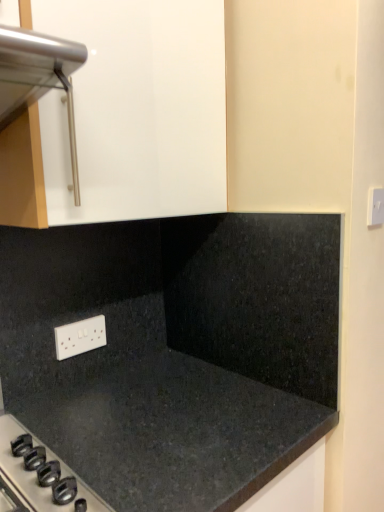
Question: Is white plastic electric outlet at lower left, the second electric outlet in the front-to-back sequence, to the right of black granite countertop at lower left from the viewer's perspective?

Choices:
 (A) no
 (B) yes

Answer: (A)

Question: Is white plastic electric outlet at lower left, which is counted as the 1th electric outlet, starting from the back, further to the viewer compared to black granite countertop at lower left?

Choices:
 (A) no
 (B) yes

Answer: (B)

Question: Is white plastic electric outlet at lower left, the second electric outlet in the front-to-back sequence, far away from black granite countertop at lower left?

Choices:
 (A) no
 (B) yes

Answer: (A)

Question: Considering the relative sizes of white plastic electric outlet at lower left, which is counted as the 1th electric outlet, starting from the back, and black granite countertop at lower left in the image provided, is white plastic electric outlet at lower left, which is counted as the 1th electric outlet, starting from the back, wider than black granite countertop at lower left?

Choices:
 (A) no
 (B) yes

Answer: (A)

Question: Considering the relative positions of white plastic electric outlet at lower left, marked as the first electric outlet in a bottom-to-top arrangement, and black granite countertop at lower left in the image provided, is white plastic electric outlet at lower left, marked as the first electric outlet in a bottom-to-top arrangement, to the left of black granite countertop at lower left from the viewer's perspective?

Choices:
 (A) yes
 (B) no

Answer: (A)

Question: Are white plastic electric outlet at lower left, which is counted as the 1th electric outlet, starting from the back, and black granite countertop at lower left beside each other?

Choices:
 (A) yes
 (B) no

Answer: (B)

Question: Is white plastic electric outlet at lower left, which is counted as the 1th electric outlet, starting from the back, in front of white plastic electric outlet at upper right, placed as the first electric outlet when sorted from front to back?

Choices:
 (A) yes
 (B) no

Answer: (B)

Question: From a real-world perspective, does white plastic electric outlet at lower left, the second electric outlet in the front-to-back sequence, sit lower than white plastic electric outlet at upper right, placed as the second electric outlet when sorted from bottom to top?

Choices:
 (A) no
 (B) yes

Answer: (B)

Question: Considering the relative sizes of white plastic electric outlet at lower left, positioned as the 1th electric outlet in left-to-right order, and white plastic electric outlet at upper right, marked as the second electric outlet in a back-to-front arrangement, in the image provided, is white plastic electric outlet at lower left, positioned as the 1th electric outlet in left-to-right order, taller than white plastic electric outlet at upper right, marked as the second electric outlet in a back-to-front arrangement,?

Choices:
 (A) no
 (B) yes

Answer: (B)

Question: From a real-world perspective, is white plastic electric outlet at lower left, positioned as the 1th electric outlet in left-to-right order, positioned over white plastic electric outlet at upper right, marked as the second electric outlet in a back-to-front arrangement, based on gravity?

Choices:
 (A) yes
 (B) no

Answer: (B)

Question: Is white plastic electric outlet at lower left, the second electric outlet in the front-to-back sequence, not close to white plastic electric outlet at upper right, the 1th electric outlet in the top-to-bottom sequence?

Choices:
 (A) yes
 (B) no

Answer: (B)

Question: Does white plastic electric outlet at lower left, the second electric outlet in the front-to-back sequence, touch white plastic electric outlet at upper right, placed as the second electric outlet when sorted from bottom to top?

Choices:
 (A) no
 (B) yes

Answer: (A)

Question: Is black granite countertop at lower left closer to the viewer compared to white plastic electric outlet at upper right, marked as the second electric outlet in a back-to-front arrangement?

Choices:
 (A) yes
 (B) no

Answer: (A)